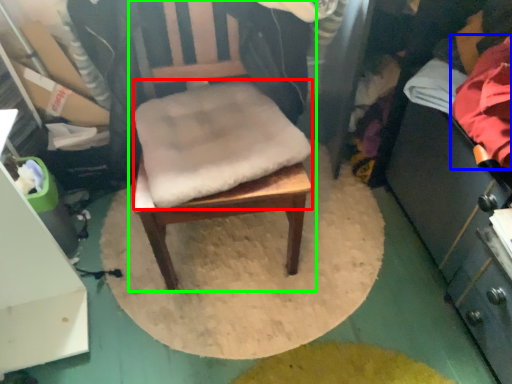
Question: Based on their relative distances, which object is farther from footrest (highlighted by a red box)? Choose from clothing (highlighted by a blue box) and chair (highlighted by a green box).

Choices:
 (A) clothing
 (B) chair

Answer: (A)